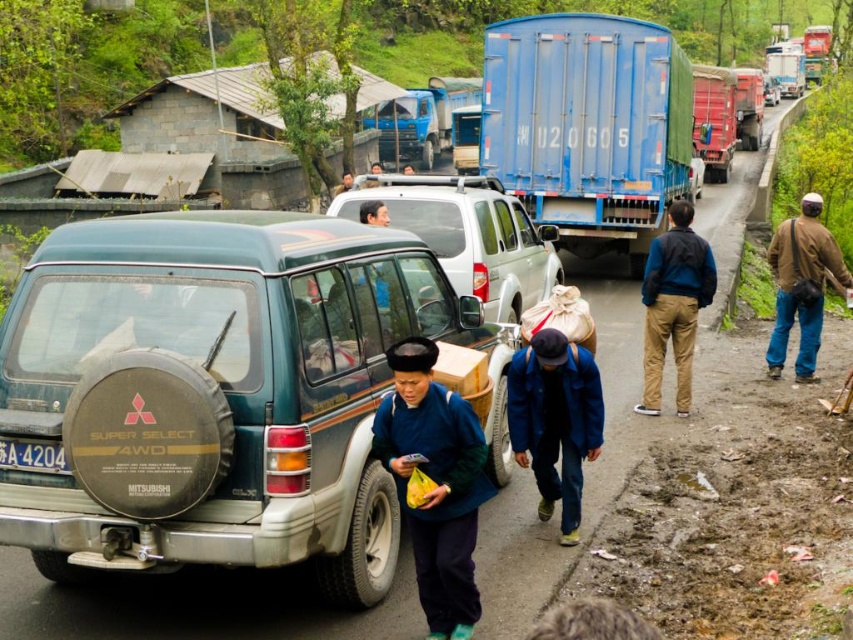
Between teal matte suv at center and brown cotton pants at right, which one has less height?

With less height is brown cotton pants at right.

Who is lower down, teal matte suv at center or brown cotton pants at right?

teal matte suv at center is lower down.

Describe the element at coordinates (236, 385) in the screenshot. I see `teal matte suv at center` at that location.

You are a GUI agent. You are given a task and a screenshot of the screen. Output one action in this format:
    pyautogui.click(x=<x>, y=<y>)
    Task: Click on the teal matte suv at center
    This screenshot has width=853, height=640.
    Given the screenshot: What is the action you would take?
    pyautogui.click(x=236, y=385)

The width and height of the screenshot is (853, 640). Describe the element at coordinates (236, 385) in the screenshot. I see `teal matte suv at center` at that location.

Is teal matte suv at center thinner than brown leather jacket at right?

In fact, teal matte suv at center might be wider than brown leather jacket at right.

Is point (302, 424) less distant than point (836, 268)?

That is True.

The image size is (853, 640). Find the location of `teal matte suv at center`. teal matte suv at center is located at coordinates (236, 385).

Between point (326, 490) and point (55, 458), which one is positioned in front?

Point (55, 458) is in front.

Who is positioned more to the right, teal matte suv at center or white plastic license plate at lower left?

From the viewer's perspective, teal matte suv at center appears more on the right side.

Is point (10, 428) positioned behind point (59, 452)?

No, it is in front of (59, 452).

Image resolution: width=853 pixels, height=640 pixels. I want to click on teal matte suv at center, so click(x=236, y=385).